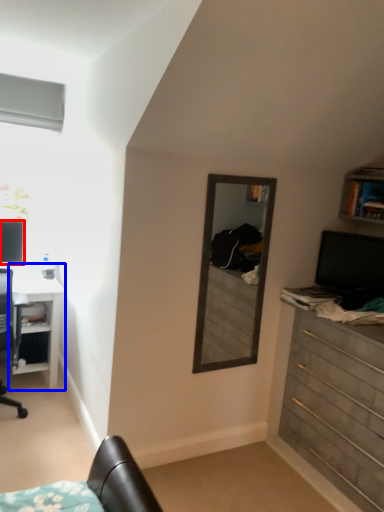
Question: Which point is closer to the camera, computer monitor (highlighted by a red box) or desk (highlighted by a blue box)?

Choices:
 (A) computer monitor
 (B) desk

Answer: (B)